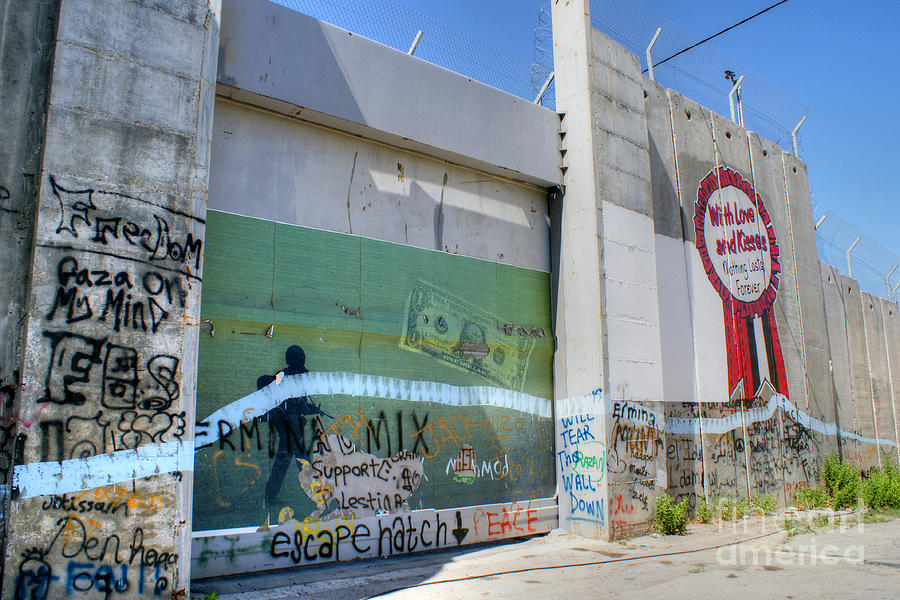
At what (x,y) coordinates should I click in order to perform the action: click on painting. Please return your answer as a coordinate pair (x, y). The width and height of the screenshot is (900, 600). Looking at the image, I should click on (371, 432).